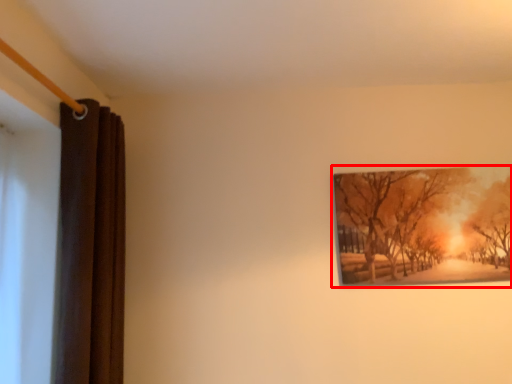
Question: From the image, what is the correct spatial relationship of picture frame (annotated by the red box) in relation to curtain?

Choices:
 (A) left
 (B) right

Answer: (B)